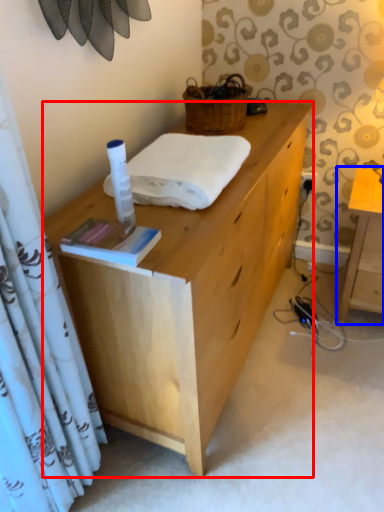
Question: Which of the following is the closest to the observer, desk (highlighted by a red box) or table (highlighted by a blue box)?

Choices:
 (A) desk
 (B) table

Answer: (A)